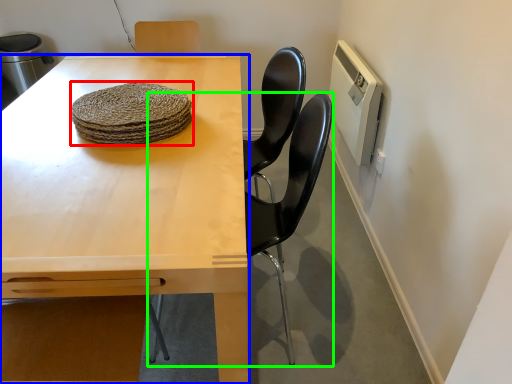
Question: Based on their relative distances, which object is nearer to food (highlighted by a red box)? Choose from table (highlighted by a blue box) and chair (highlighted by a green box).

Choices:
 (A) table
 (B) chair

Answer: (A)